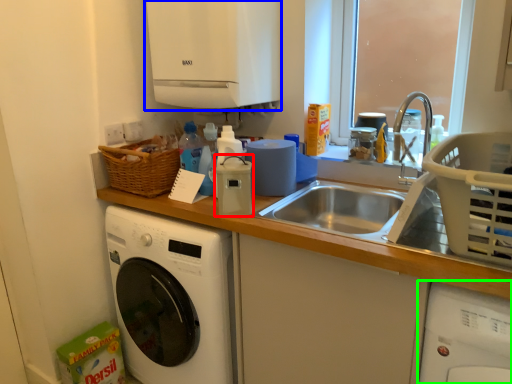
Question: Considering the real-world distances, which object is farthest from appliance (highlighted by a red box)? appliance (highlighted by a blue box) or washing machine (highlighted by a green box)?

Choices:
 (A) appliance
 (B) washing machine

Answer: (B)